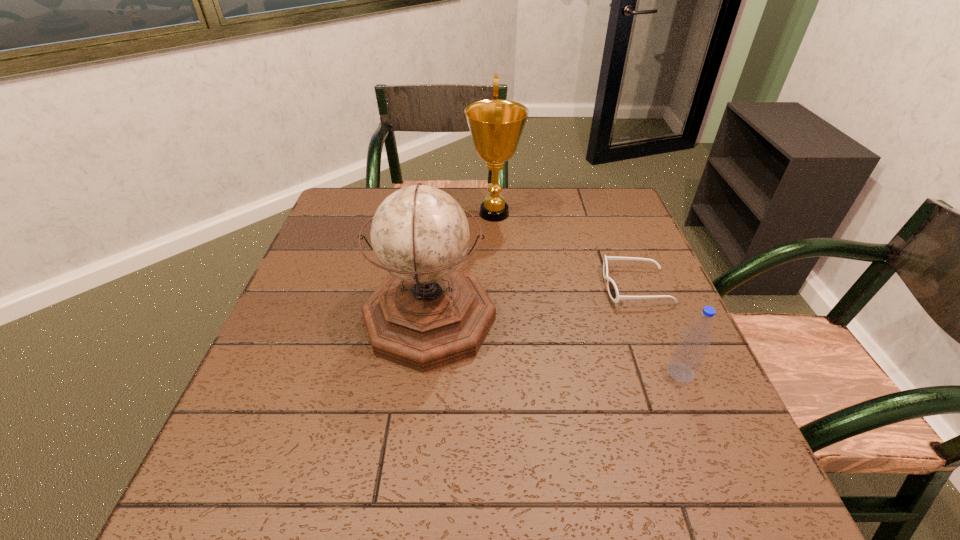
Identify the location of blank space located 0.270m with the lenses of the shortest object facing outward. (493, 286).

Find the location of a particular element. vacant space located 0.120m with the lenses of the shortest object facing outward is located at coordinates (555, 286).

Locate an element on the screen. The image size is (960, 540). object at the far edge is located at coordinates (496, 126).

Where is `water bottle located in the right edge section of the desktop`? The image size is (960, 540). water bottle located in the right edge section of the desktop is located at coordinates (688, 356).

I want to click on sunglasses present at the right edge, so click(x=613, y=292).

The height and width of the screenshot is (540, 960). I want to click on vacant area at the far edge, so click(445, 187).

In the image, there is a desktop. Where is `free space at the near edge`? The width and height of the screenshot is (960, 540). free space at the near edge is located at coordinates tap(508, 515).

Find the location of a particular element. vacant position at the left edge of the desktop is located at coordinates (327, 292).

You are a GUI agent. You are given a task and a screenshot of the screen. Output one action in this format:
    pyautogui.click(x=<x>, y=<y>)
    Task: Click on the vacant area at the right edge
    This screenshot has height=540, width=960.
    Given the screenshot: What is the action you would take?
    pyautogui.click(x=621, y=301)

The height and width of the screenshot is (540, 960). I want to click on vacant space at the far right corner of the desktop, so click(x=634, y=220).